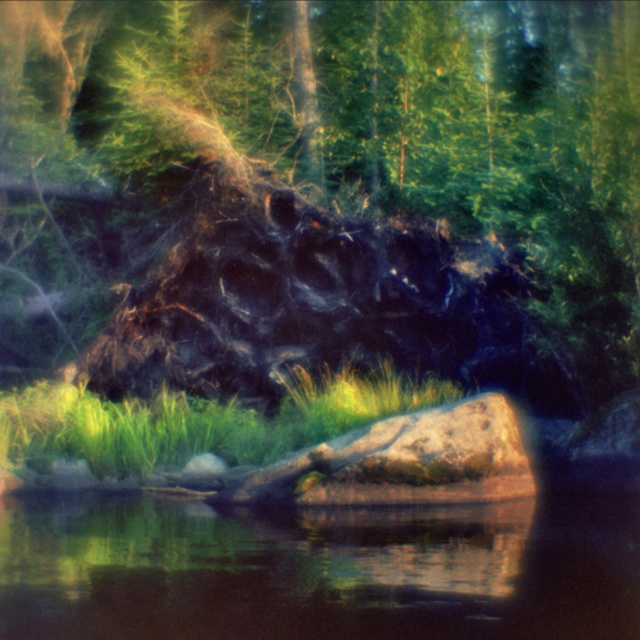
Question: Which point is closer to the camera taking this photo?

Choices:
 (A) (129, 468)
 (B) (122, 301)

Answer: (A)

Question: Is charcoal textured log at center below green grass at lower center?

Choices:
 (A) no
 (B) yes

Answer: (A)

Question: Is charcoal textured log at center wider than green grass at lower center?

Choices:
 (A) yes
 (B) no

Answer: (A)

Question: Is charcoal textured log at center below green grass at lower center?

Choices:
 (A) yes
 (B) no

Answer: (B)